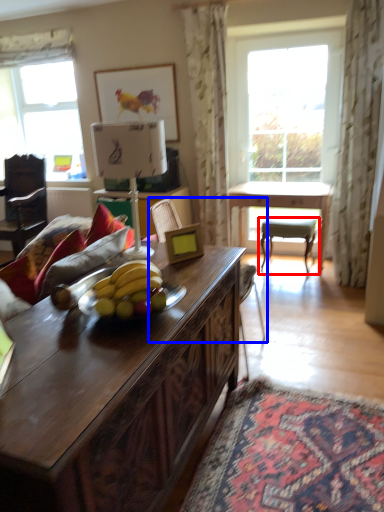
Question: Which object is further to the camera taking this photo, chair (highlighted by a red box) or swivel chair (highlighted by a blue box)?

Choices:
 (A) chair
 (B) swivel chair

Answer: (A)